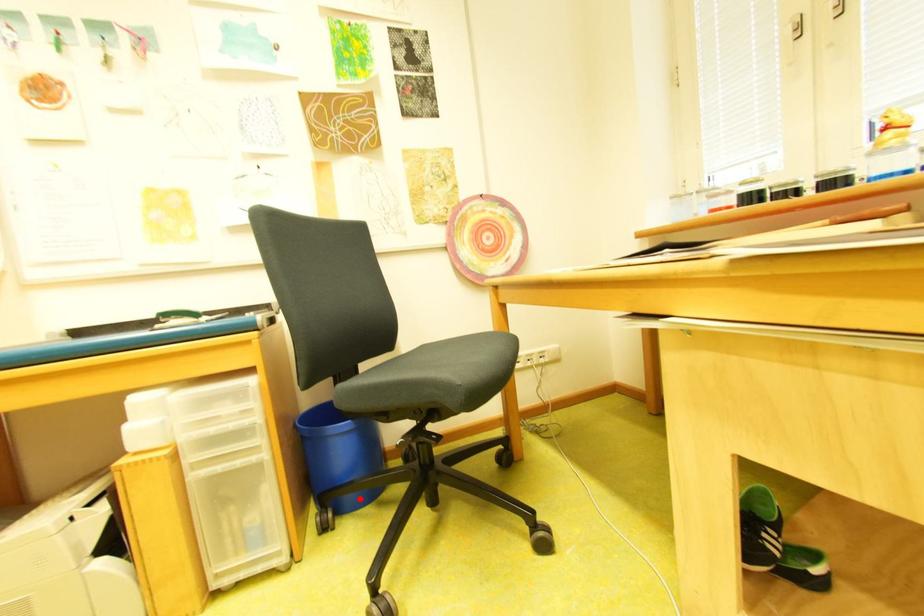
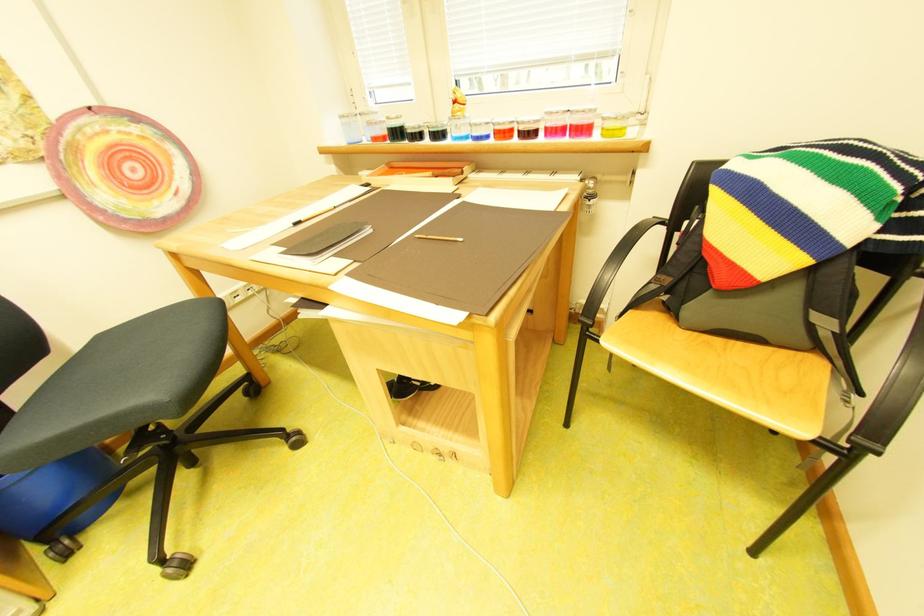
Where in the second image is the point corresponding to the highlighted location from the first image?

(96, 515)